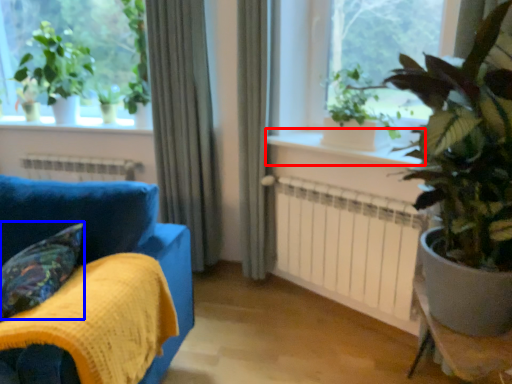
Question: Which point is closer to the camera, window sill (highlighted by a red box) or pillow (highlighted by a blue box)?

Choices:
 (A) window sill
 (B) pillow

Answer: (B)